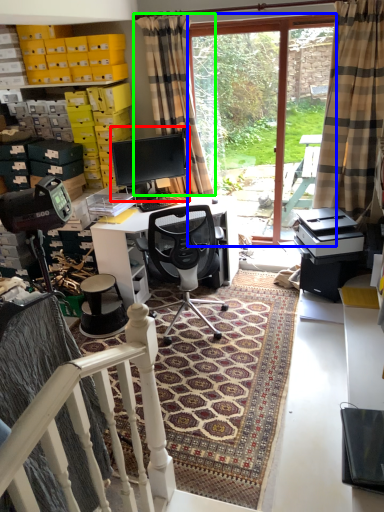
Question: Considering the real-world distances, which object is farthest from computer monitor (highlighted by a red box)? bay window (highlighted by a blue box) or curtain (highlighted by a green box)?

Choices:
 (A) bay window
 (B) curtain

Answer: (A)